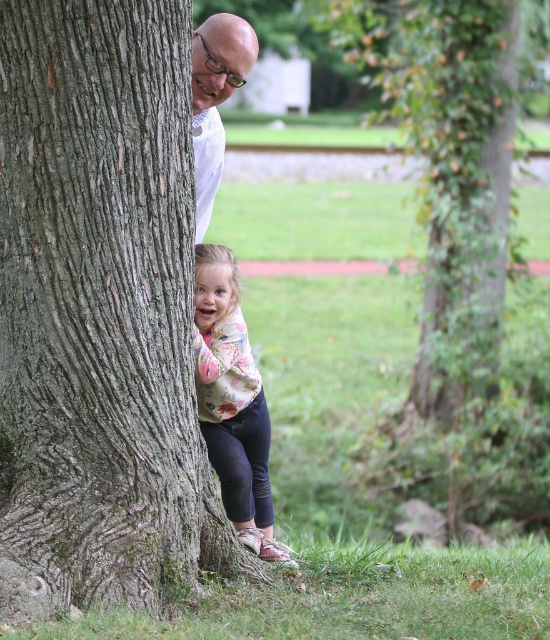
Is point (56, 506) more distant than point (438, 148)?

That is False.

Is smooth brown tree trunk at left positioned at the back of green ivy-covered tree at center?

No.

This screenshot has width=550, height=640. Find the location of `smooth brown tree trunk at left`. smooth brown tree trunk at left is located at coordinates (100, 312).

Which of these two, smooth brown tree trunk at left or floral sweater at lower center, stands shorter?

floral sweater at lower center is shorter.

Is point (182, 413) more distant than point (224, 376)?

No, it is in front of (224, 376).

Image resolution: width=550 pixels, height=640 pixels. What are the coordinates of `smooth brown tree trunk at left` in the screenshot? It's located at (100, 312).

Is point (116, 109) positioned after point (196, 141)?

No, it is not.

Which is above, smooth brown tree trunk at left or white matte shirt at upper center?

Positioned higher is white matte shirt at upper center.

At what (x,y) coordinates should I click in order to perform the action: click on smooth brown tree trunk at left. Please return your answer as a coordinate pair (x, y). Image resolution: width=550 pixels, height=640 pixels. Looking at the image, I should click on (100, 312).